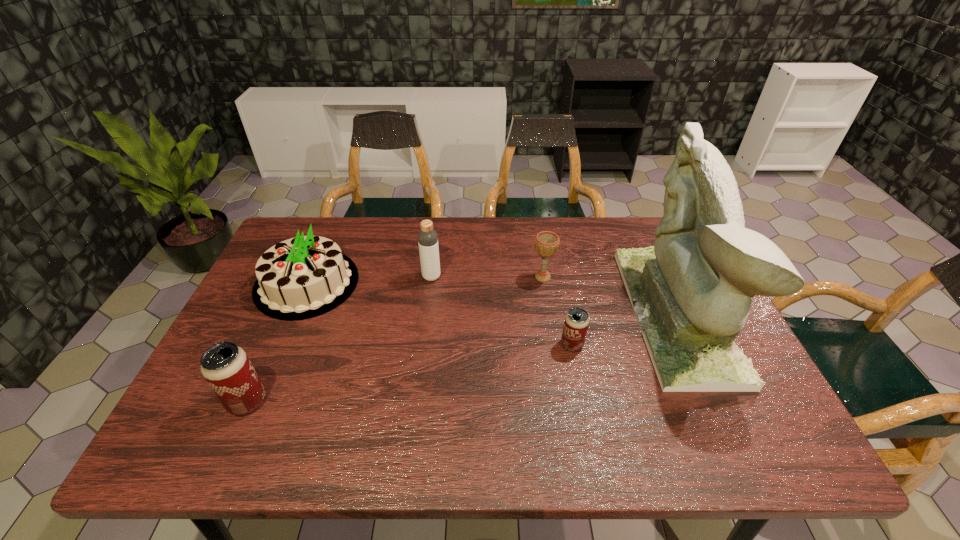
I want to click on vacant position located on the left of the shortest object, so click(517, 345).

Identify the location of free space located on the right of the chalice. Image resolution: width=960 pixels, height=540 pixels. (686, 277).

Where is `vacant space situated on the base of the tallest object`? This screenshot has height=540, width=960. vacant space situated on the base of the tallest object is located at coordinates (602, 314).

Find the location of a particular element. The image size is (960, 540). free space located on the base of the tallest object is located at coordinates (532, 314).

Find the location of a particular element. This screenshot has width=960, height=540. vacant region located on the base of the tallest object is located at coordinates (546, 314).

I want to click on vacant region located 0.320m on the right of the birthday cake, so click(468, 284).

This screenshot has width=960, height=540. What are the coordinates of `vacant region located 0.360m on the right of the third object from left to right` in the screenshot? It's located at (563, 277).

The width and height of the screenshot is (960, 540). Find the location of `sculpture present at the far edge`. sculpture present at the far edge is located at coordinates (691, 292).

This screenshot has height=540, width=960. I want to click on birthday cake located in the far edge section of the desktop, so click(300, 278).

Where is `beer can that is at the near edge`? This screenshot has width=960, height=540. beer can that is at the near edge is located at coordinates (x=226, y=367).